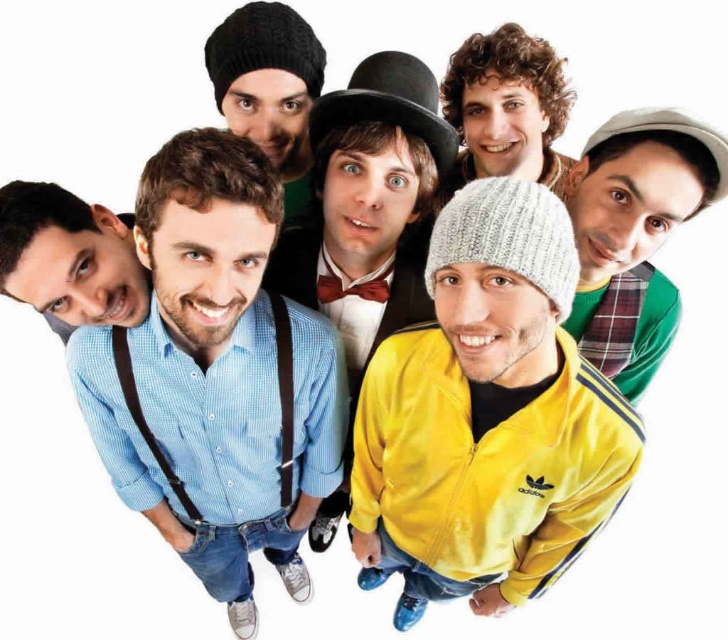
You are a photographer trying to capture a photo of the blue checkered shirt at center and the gray knit beanie at center. From the current angle, which one is more to the left?

The blue checkered shirt at center is positioned on the left side of gray knit beanie at center, so it is more to the left.

You are a photographer trying to capture a closeup of the curly hair at upper center without including the yellow fabric jacket at center in the frame. Based on their positions, is this possible?

The yellow fabric jacket at center is to the left of curly hair at upper center, so if you position your camera to the right side of the jacket, you can capture the curly hair at upper center without including the jacket in the frame.

You are a photographer trying to capture a closeup shot of the blue checkered shirt at center and the gray knit beanie at center. Since you want to focus on both items equally, which one should you adjust your camera focus to prioritize due to their sizes?

The blue checkered shirt at center is bigger than the gray knit beanie at center, so you should prioritize focusing on the gray knit beanie at center to ensure both items appear equally sharp in the photo.